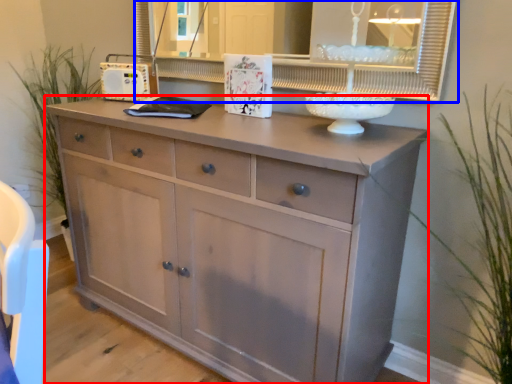
Question: Which object appears closest to the camera in this image, chest of drawers (highlighted by a red box) or medicine cabinet (highlighted by a blue box)?

Choices:
 (A) chest of drawers
 (B) medicine cabinet

Answer: (A)